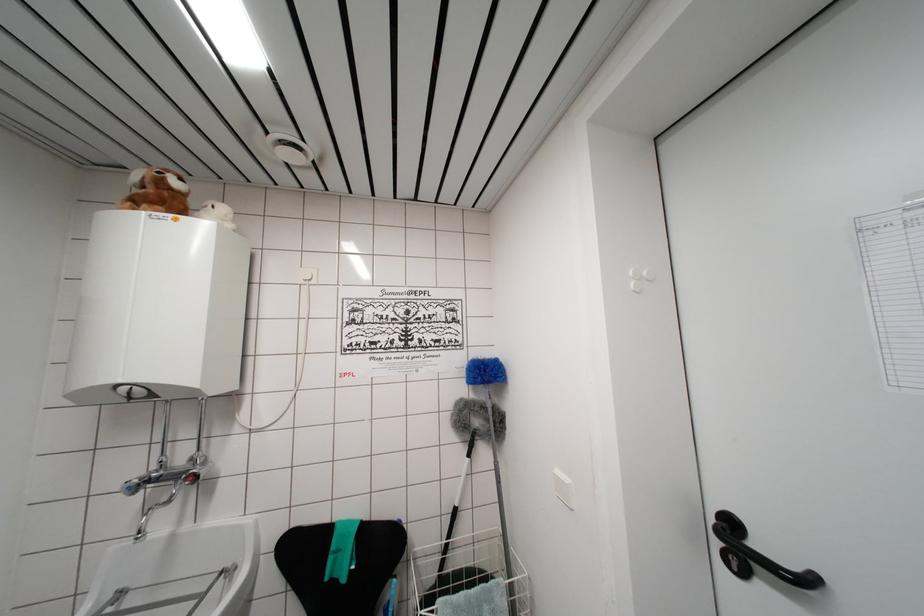
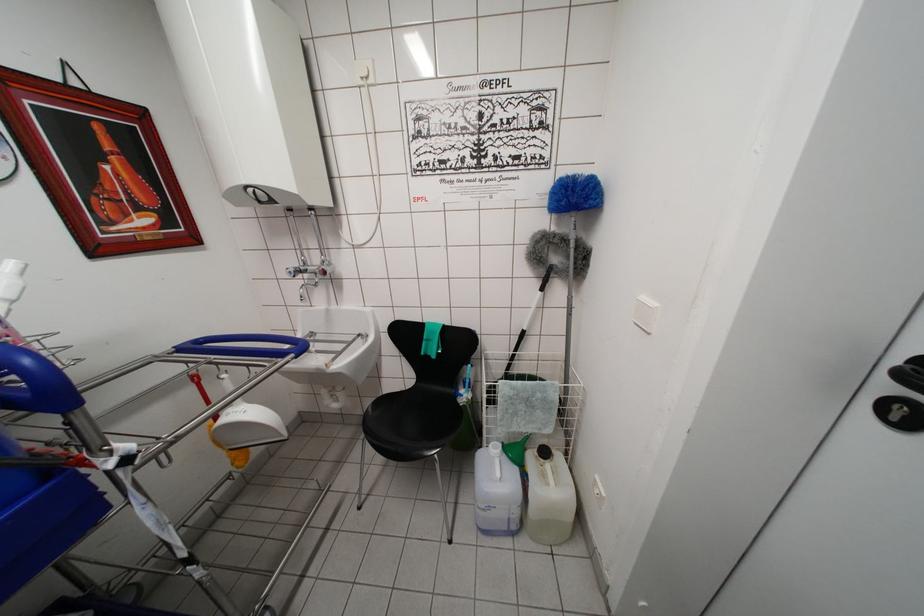
Locate, in the second image, the point that corresponds to the point at 570,485 in the first image.

(657, 308)